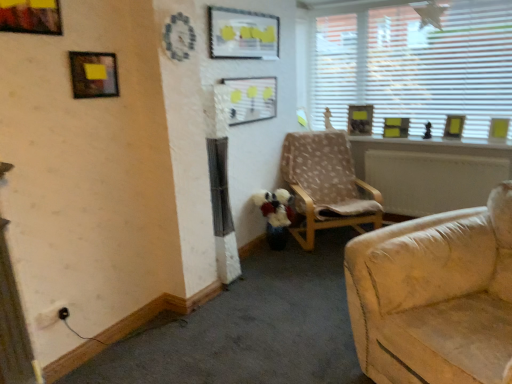
Question: Would you say metallic gold picture frame at upper left, which is the 1th picture frame from front to back, is outside matte plastic picture frame at upper center, acting as the third picture frame starting from the front?

Choices:
 (A) yes
 (B) no

Answer: (A)

Question: Is metallic gold picture frame at upper left, the eighth picture frame when ordered from right to left, bigger than matte plastic picture frame at upper center, which is the 6th picture frame in right-to-left order?

Choices:
 (A) no
 (B) yes

Answer: (A)

Question: Is metallic gold picture frame at upper left, the eighth picture frame when ordered from right to left, to the left of matte plastic picture frame at upper center, which is counted as the 6th picture frame, starting from the back, from the viewer's perspective?

Choices:
 (A) no
 (B) yes

Answer: (B)

Question: Would you say matte plastic picture frame at upper center, which is the 6th picture frame in right-to-left order, is part of metallic gold picture frame at upper left, the eighth picture frame when ordered from right to left,'s contents?

Choices:
 (A) no
 (B) yes

Answer: (A)

Question: Does metallic gold picture frame at upper left, which is the 1th picture frame from front to back, have a lesser height compared to matte plastic picture frame at upper center, which is the 6th picture frame in right-to-left order?

Choices:
 (A) yes
 (B) no

Answer: (A)

Question: In terms of size, does metallic gold picture frame at upper left, which is the 1th picture frame from front to back, appear bigger or smaller than black plastic electric outlet at lower left?

Choices:
 (A) big
 (B) small

Answer: (A)

Question: From the image's perspective, is metallic gold picture frame at upper left, which is the 1th picture frame from front to back, located above or below black plastic electric outlet at lower left?

Choices:
 (A) above
 (B) below

Answer: (A)

Question: Considering the positions of metallic gold picture frame at upper left, which is the 1th picture frame from front to back, and black plastic electric outlet at lower left in the image, is metallic gold picture frame at upper left, which is the 1th picture frame from front to back, taller or shorter than black plastic electric outlet at lower left?

Choices:
 (A) tall
 (B) short

Answer: (A)

Question: Would you say metallic gold picture frame at upper left, which is the 1th picture frame from front to back, is to the left or to the right of black plastic electric outlet at lower left in the picture?

Choices:
 (A) right
 (B) left

Answer: (A)

Question: From the image's perspective, relative to matte black picture frame at upper left, the 7th picture frame positioned from the right, is white blinds at upper right above or below?

Choices:
 (A) below
 (B) above

Answer: (B)

Question: Is point (346, 69) positioned closer to the camera than point (111, 94)?

Choices:
 (A) closer
 (B) farther

Answer: (B)

Question: Is white blinds at upper right in front of or behind matte black picture frame at upper left, the 7th picture frame positioned from the right, in the image?

Choices:
 (A) behind
 (B) front

Answer: (A)

Question: Considering the positions of white blinds at upper right and matte black picture frame at upper left, the second picture frame in the left-to-right sequence, in the image, is white blinds at upper right wider or thinner than matte black picture frame at upper left, the second picture frame in the left-to-right sequence,?

Choices:
 (A) wide
 (B) thin

Answer: (B)

Question: Is matte plastic picture frame at center, which is the fifth picture frame in right-to-left order, taller or shorter than white blinds at upper right?

Choices:
 (A) tall
 (B) short

Answer: (B)

Question: Is matte plastic picture frame at center, which is the fifth picture frame in right-to-left order, bigger or smaller than white blinds at upper right?

Choices:
 (A) small
 (B) big

Answer: (A)